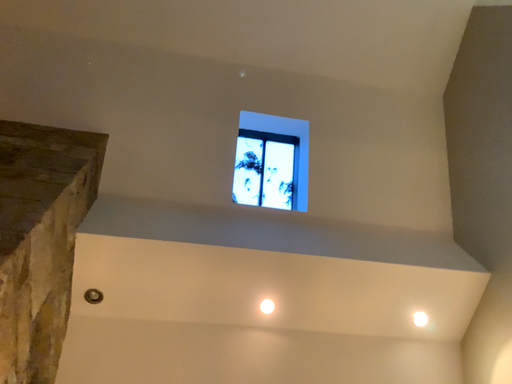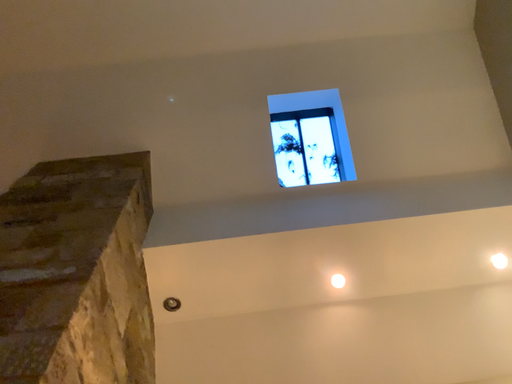
Question: How did the camera likely rotate when shooting the video?

Choices:
 (A) rotated right
 (B) rotated left

Answer: (B)